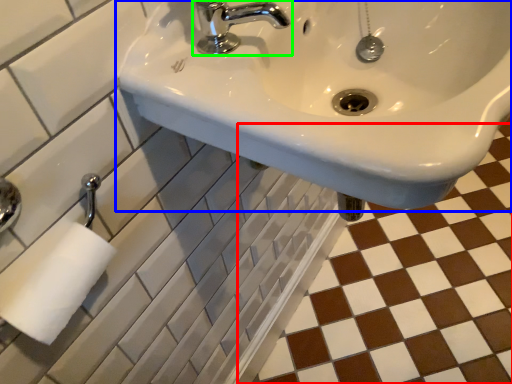
Question: Based on their relative distances, which object is farther from ceramic tile (highlighted by a red box)? Choose from sink (highlighted by a blue box) and tap (highlighted by a green box).

Choices:
 (A) sink
 (B) tap

Answer: (B)